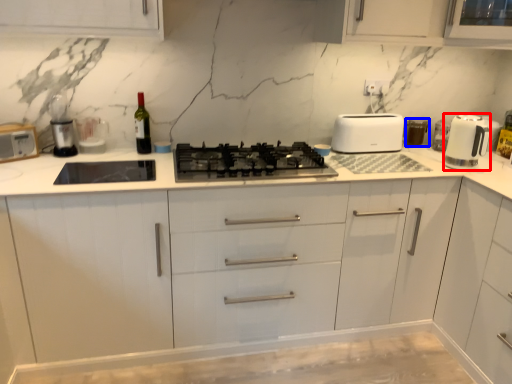
Question: Which object is further to the camera taking this photo, home appliance (highlighted by a red box) or appliance (highlighted by a blue box)?

Choices:
 (A) home appliance
 (B) appliance

Answer: (B)